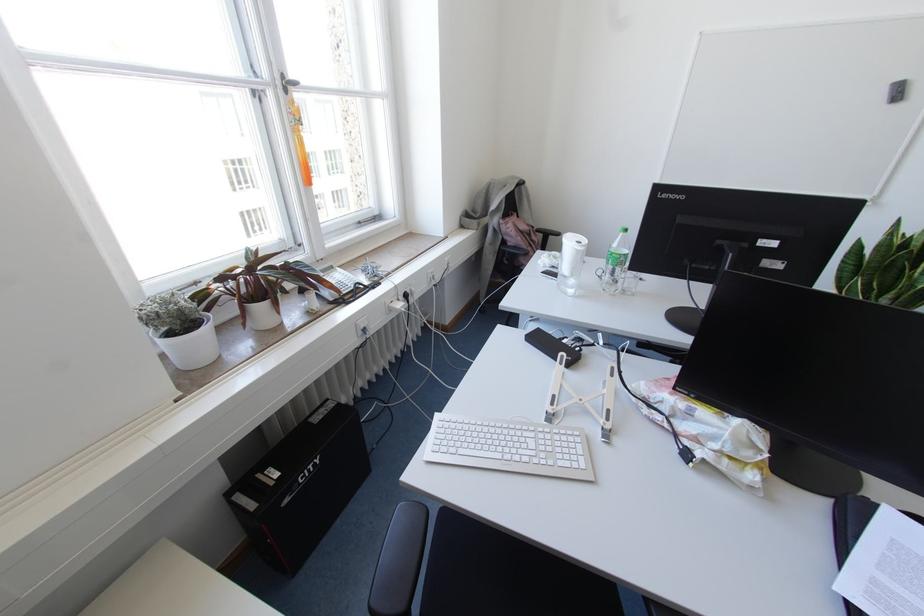
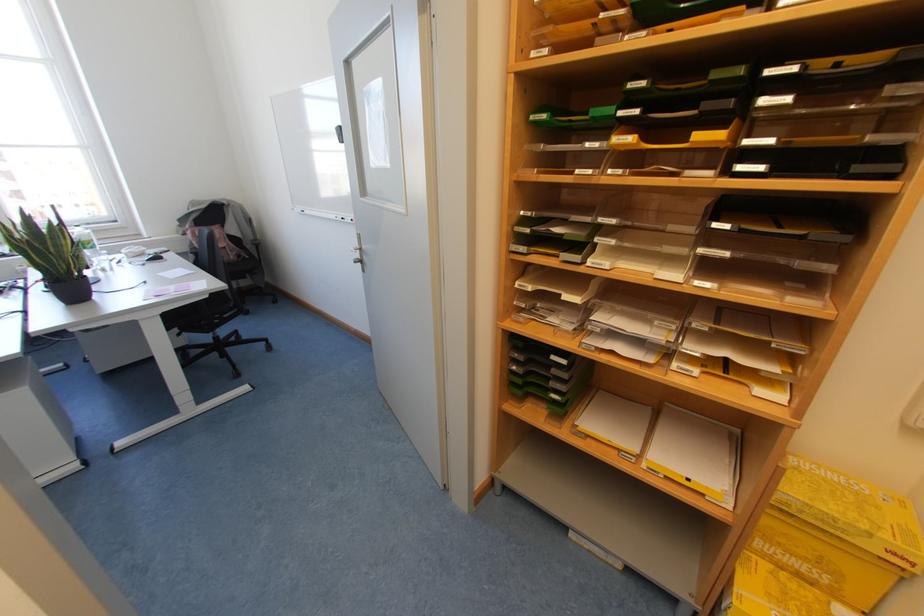
Question: What movement of the cameraman would produce the second image?

Choices:
 (A) Left
 (B) Right
 (C) Forward
 (D) Backward

Answer: (B)